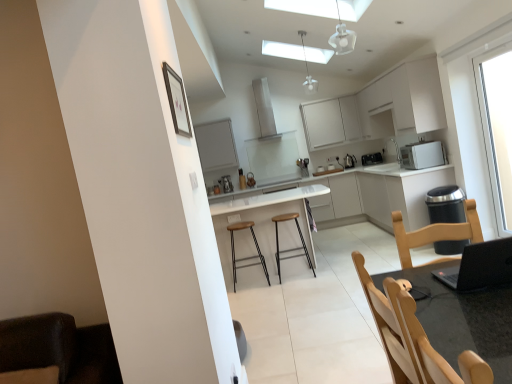
Identify the location of clear glass window at upper right. (497, 126).

Find the location of a particular element. white matte exhaust hood at upper center is located at coordinates click(267, 111).

Measure the distance between point (264, 231) and camera.

4.98 meters.

Describe the element at coordinates (292, 248) in the screenshot. I see `metallic silver bar stool at center, which appears as the 1th bar stool when viewed from the right` at that location.

Image resolution: width=512 pixels, height=384 pixels. I want to click on translucent glass pendant light at upper center, the second light fixture from the back, so coord(342,37).

Is satin silver coffee machine at center facing away from black plastic toaster at upper right, the 2th appliance positioned from the back?

That's not correct — satin silver coffee machine at center is not looking away from black plastic toaster at upper right, the 2th appliance positioned from the back.

Is satin silver coffee machine at center surrounding black plastic toaster at upper right, which is the 2th appliance in front-to-back order?

No, black plastic toaster at upper right, which is the 2th appliance in front-to-back order, is not inside satin silver coffee machine at center.

Looking at this image, does satin silver coffee machine at center have a greater height compared to black plastic toaster at upper right, which is the 2th appliance in front-to-back order?

Yes, satin silver coffee machine at center is taller than black plastic toaster at upper right, which is the 2th appliance in front-to-back order.

Is point (224, 181) closer to camera compared to point (369, 156)?

Yes, it is in front of point (369, 156).

Is clear glass window at upper right smaller than white glass pendant light at upper center, which appears as the 1th light fixture when viewed from the back?

No, clear glass window at upper right is not smaller than white glass pendant light at upper center, which appears as the 1th light fixture when viewed from the back.

Does clear glass window at upper right turn towards white glass pendant light at upper center, which appears as the 1th light fixture when viewed from the back?

No.

At what (x,y) coordinates should I click in order to perform the action: click on light fixture behind the clear glass window at upper right. Please return your answer as a coordinate pair (x, y). The width and height of the screenshot is (512, 384). Looking at the image, I should click on (308, 71).

From a real-world perspective, who is located higher, clear glass window at upper right or white glass pendant light at upper center, placed as the 2th light fixture when sorted from front to back?

In real-world perspective, white glass pendant light at upper center, placed as the 2th light fixture when sorted from front to back, is above.

Consider the image. Which is behind, black plastic toaster at upper right, which is the 2th appliance in front-to-back order, or black matte laptop at lower right?

black plastic toaster at upper right, which is the 2th appliance in front-to-back order, is behind.

Can you confirm if black plastic toaster at upper right, which is the 2th appliance in front-to-back order, is shorter than black matte laptop at lower right?

Correct, black plastic toaster at upper right, which is the 2th appliance in front-to-back order, is not as tall as black matte laptop at lower right.

Can you see black plastic toaster at upper right, which is the 2th appliance in front-to-back order, touching black matte laptop at lower right?

There is a gap between black plastic toaster at upper right, which is the 2th appliance in front-to-back order, and black matte laptop at lower right.

From the image's perspective, is translucent glass pendant light at upper center, positioned as the first light fixture in front-to-back order, positioned above or below white glossy microwave at upper right, the 3th appliance in the back-to-front sequence?

From the image's perspective, translucent glass pendant light at upper center, positioned as the first light fixture in front-to-back order, appears above white glossy microwave at upper right, the 3th appliance in the back-to-front sequence.

What are the coordinates of `the 1st appliance behind the translucent glass pendant light at upper center, the second light fixture from the back` in the screenshot? It's located at (422, 155).

Which object is closer to the camera, translucent glass pendant light at upper center, the second light fixture from the back, or white glossy microwave at upper right, the 3th appliance in the back-to-front sequence?

translucent glass pendant light at upper center, the second light fixture from the back, is more forward.

Which of these two, white matte exhaust hood at upper center or satin silver coffee machine at center, is bigger?

white matte exhaust hood at upper center.

From the image's perspective, would you say white matte exhaust hood at upper center is positioned over satin silver coffee machine at center?

Yes, from the image's perspective, white matte exhaust hood at upper center is above satin silver coffee machine at center.

Based on their positions, is white matte exhaust hood at upper center located to the left or right of satin silver coffee machine at center?

In the image, white matte exhaust hood at upper center appears on the right side of satin silver coffee machine at center.

Measure the distance from white matte exhaust hood at upper center to satin silver coffee machine at center.

The distance of white matte exhaust hood at upper center from satin silver coffee machine at center is 5.02 feet.

From a real-world perspective, which is physically above, white glossy countertop at center or satin silver coffee machine at center?

From a 3D spatial view, satin silver coffee machine at center is above.

From the image's perspective, is white glossy countertop at center positioned above or below satin silver coffee machine at center?

Based on their image positions, white glossy countertop at center is located beneath satin silver coffee machine at center.

Which is more to the right, white glossy countertop at center or satin silver coffee machine at center?

From the viewer's perspective, white glossy countertop at center appears more on the right side.

Does point (372, 180) come behind point (222, 176)?

No, it is in front of (222, 176).

Considering the sizes of objects white glossy microwave at upper right, marked as the first appliance in a front-to-back arrangement, and black matte laptop at lower right in the image provided, who is smaller, white glossy microwave at upper right, marked as the first appliance in a front-to-back arrangement, or black matte laptop at lower right?

black matte laptop at lower right.

Is white glossy microwave at upper right, the 3th appliance in the back-to-front sequence, oriented away from black matte laptop at lower right?

No, white glossy microwave at upper right, the 3th appliance in the back-to-front sequence,'s orientation is not away from black matte laptop at lower right.

Is white glossy microwave at upper right, the 3th appliance in the back-to-front sequence, taller or shorter than black matte laptop at lower right?

In the image, white glossy microwave at upper right, the 3th appliance in the back-to-front sequence, appears to be taller than black matte laptop at lower right.

Is point (439, 146) in front of point (451, 285)?

That is False.

Image resolution: width=512 pixels, height=384 pixels. Identify the location of coffee machine that is above the black plastic toaster at upper right, which is the 2th appliance in front-to-back order (from a real-world perspective). (226, 183).

You are a GUI agent. You are given a task and a screenshot of the screen. Output one action in this format:
    pyautogui.click(x=<x>, y=<y>)
    Task: Click on the 2nd light fixture counting from the left side of the clear glass window at upper right
    
    Given the screenshot: What is the action you would take?
    pyautogui.click(x=308, y=71)

Looking at the image, which one is located closer to white glossy countertop at center, clear glass window at upper right or metallic silver bar stool at center, the second bar stool when ordered from left to right?

The object closer to white glossy countertop at center is clear glass window at upper right.

From the image, which object appears to be farther from translucent glass pendant light at upper center, positioned as the first light fixture in front-to-back order, white glossy microwave at upper right, marked as the first appliance in a front-to-back arrangement, or black plastic toaster at upper right, the 2th appliance positioned from the back?

black plastic toaster at upper right, the 2th appliance positioned from the back, is further to translucent glass pendant light at upper center, positioned as the first light fixture in front-to-back order.

Which object lies nearer to the anchor point clear glass window at upper right, black plastic toaster at upper right, which is the 2th appliance in front-to-back order, or white matte cabinet at upper center?

The object closer to clear glass window at upper right is white matte cabinet at upper center.

Based on their spatial positions, is metallic silver bar stool at center, the second bar stool when ordered from left to right, or black matte laptop at lower right closer to white glossy microwave at upper right, marked as the first appliance in a front-to-back arrangement?

metallic silver bar stool at center, the second bar stool when ordered from left to right.

From the image, which object appears to be nearer to white glossy bar stools at center, translucent glass pendant light at upper center, the second light fixture from the back, or clear glass window at upper right?

clear glass window at upper right.

When comparing their distances from satin silver coffee machine at center, does white glossy microwave at upper right, marked as the first appliance in a front-to-back arrangement, or translucent glass pendant light at upper center, positioned as the first light fixture in front-to-back order, seem closer?

translucent glass pendant light at upper center, positioned as the first light fixture in front-to-back order, is positioned closer to the anchor satin silver coffee machine at center.

Which object lies further to the anchor point clear glass window at upper right, white glossy bar stools at center or white glossy microwave at upper right, marked as the first appliance in a front-to-back arrangement?

white glossy bar stools at center.

Looking at the image, which one is located further to black plastic toaster at upper right, which is the 2th appliance in front-to-back order, polished stainless steel kettle at center-right, positioned as the 1th appliance in back-to-front order, or white glossy countertop at center?

Based on the image, white glossy countertop at center appears to be further to black plastic toaster at upper right, which is the 2th appliance in front-to-back order.

Find the location of a particular element. exhaust hood between white matte cabinet at upper center and polished stainless steel kettle at center-right, positioned as the 1th appliance in back-to-front order, from front to back is located at coordinates (267, 111).

At what (x,y) coordinates should I click in order to perform the action: click on light fixture between white glossy bar stools at center and polished stainless steel kettle at center-right, positioned as the 1th appliance in back-to-front order, along the z-axis. Please return your answer as a coordinate pair (x, y). The width and height of the screenshot is (512, 384). Looking at the image, I should click on (308, 71).

In order to click on light fixture between black matte laptop at lower right and white glossy microwave at upper right, marked as the first appliance in a front-to-back arrangement, in the front-back direction in this screenshot , I will do `click(342, 37)`.

This screenshot has height=384, width=512. What are the coordinates of `cabinetry positioned between black matte laptop at lower right and satin silver coffee machine at center from near to far` in the screenshot? It's located at (379, 107).